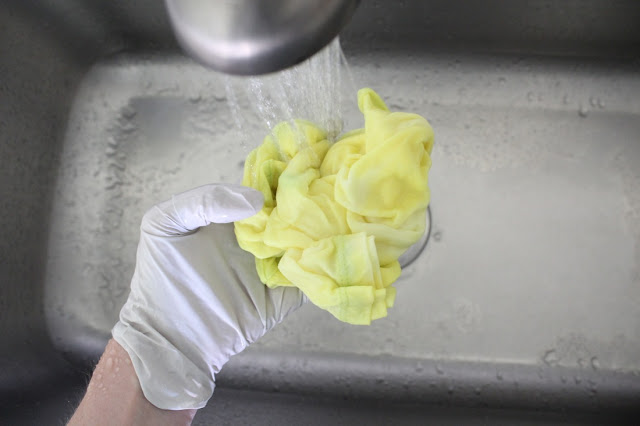
Find the location of `sides of the sink`. sides of the sink is located at coordinates point(36,62), point(35,393), point(308,406), point(404,4), point(582,21), point(107,21).